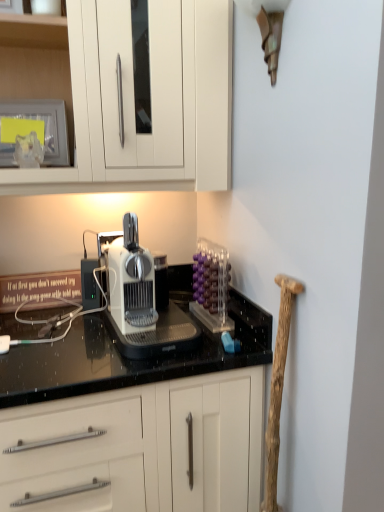
The height and width of the screenshot is (512, 384). In order to click on transparent acrylic container at upper right in this screenshot , I will do `click(211, 286)`.

Measure the distance between matte glass frame at upper left and camera.

The depth of matte glass frame at upper left is 3.73 feet.

What do you see at coordinates (35, 129) in the screenshot?
I see `matte glass frame at upper left` at bounding box center [35, 129].

Locate an element on the screen. black granite countertop at center is located at coordinates (127, 358).

Identify the location of transparent acrylic container at upper right. The width and height of the screenshot is (384, 512). (211, 286).

Which is more distant, [280,412] or [126,380]?

Point [280,412]

From the picture: Does wooden at right turn towards black granite countertop at center?

No.

Who is shorter, wooden at right or black granite countertop at center?

With less height is wooden at right.

What's the angular difference between wooden at right and black granite countertop at center's facing directions?

The angle between the facing direction of wooden at right and the facing direction of black granite countertop at center is 89.8 degrees.

From the picture: Does transparent acrylic container at upper right come behind white plastic coffee machine at center?

Yes, it is behind white plastic coffee machine at center.

Based on the photo, how many degrees apart are the facing directions of transparent acrylic container at upper right and white plastic coffee machine at center?

There is a 3.25-degree angle between the facing directions of transparent acrylic container at upper right and white plastic coffee machine at center.

Based on the photo, can you see transparent acrylic container at upper right touching white plastic coffee machine at center?

transparent acrylic container at upper right is not next to white plastic coffee machine at center, and they're not touching.

Which is more distant, (x=42, y=137) or (x=289, y=294)?

The point (x=42, y=137) is farther.

Considering the sizes of objects matte glass frame at upper left and wooden at right in the image provided, who is shorter, matte glass frame at upper left or wooden at right?

matte glass frame at upper left.

Could you tell me if matte glass frame at upper left is turned towards wooden at right?

No, matte glass frame at upper left is not oriented towards wooden at right.

Is matte glass frame at upper left to the left or to the right of wooden at right in the image?

Clearly, matte glass frame at upper left is on the left of wooden at right in the image.

What's the angular difference between white plastic coffee machine at center and matte glass frame at upper left's facing directions?

The angular difference between white plastic coffee machine at center and matte glass frame at upper left is 9.82 degrees.

Is white plastic coffee machine at center further to the viewer compared to matte glass frame at upper left?

No, white plastic coffee machine at center is closer to the viewer.

Is white plastic coffee machine at center looking in the opposite direction of matte glass frame at upper left?

That's not correct — white plastic coffee machine at center is not looking away from matte glass frame at upper left.

Between white plastic coffee machine at center and matte glass frame at upper left, which one has smaller width?

With smaller width is matte glass frame at upper left.

Find the location of a particular element. countertop below the wooden at right (from a real-world perspective) is located at coordinates (127, 358).

Which of these two, black granite countertop at center or wooden at right, is wider?

black granite countertop at center.

Is black granite countertop at center facing towards wooden at right?

Yes, black granite countertop at center is facing wooden at right.

From a real-world perspective, is black granite countertop at center beneath wooden at right?

Yes, from a real-world perspective, black granite countertop at center is under wooden at right.

From the image's perspective, is matte glass frame at upper left located above or below white plastic coffee machine at center?

Based on their image positions, matte glass frame at upper left is located above white plastic coffee machine at center.

Is matte glass frame at upper left positioned with its back to white plastic coffee machine at center?

No.

Which object is further away from the camera taking this photo, matte glass frame at upper left or white plastic coffee machine at center?

Positioned behind is matte glass frame at upper left.

Locate an element on the screen. appliance located on the left of white plastic coffee machine at center is located at coordinates (35, 129).

Can you tell me how much white plastic coffee machine at center and wooden at right differ in facing direction?

93.4 degrees.

Considering the sizes of objects white plastic coffee machine at center and wooden at right in the image provided, who is shorter, white plastic coffee machine at center or wooden at right?

white plastic coffee machine at center.

Which object is wider, white plastic coffee machine at center or wooden at right?

Wider between the two is white plastic coffee machine at center.

Find the location of a particular element. hammer that is behind the black granite countertop at center is located at coordinates (278, 388).

This screenshot has width=384, height=512. Find the location of `kitchen appliance below the white plastic coffee machine at center (from a real-world perspective)`. kitchen appliance below the white plastic coffee machine at center (from a real-world perspective) is located at coordinates (211, 286).

Looking at the image, which one is located closer to white plastic coffee machine at center, matte glass frame at upper left or black granite countertop at center?

Among the two, black granite countertop at center is located nearer to white plastic coffee machine at center.

From the image, which object appears to be nearer to wooden at right, black granite countertop at center or transparent acrylic container at upper right?

Among the two, black granite countertop at center is located nearer to wooden at right.

From the image, which object appears to be nearer to white plastic coffee machine at center, black granite countertop at center or wooden at right?

Among the two, black granite countertop at center is located nearer to white plastic coffee machine at center.

From the image, which object appears to be nearer to white plastic coffee machine at center, wooden at right or transparent acrylic container at upper right?

transparent acrylic container at upper right.

Based on their spatial positions, is transparent acrylic container at upper right or matte glass frame at upper left closer to black granite countertop at center?

transparent acrylic container at upper right.

Based on their spatial positions, is wooden at right or matte glass frame at upper left closer to transparent acrylic container at upper right?

wooden at right is closer to transparent acrylic container at upper right.

Looking at this image, looking at the image, which one is located further to white plastic coffee machine at center, transparent acrylic container at upper right or matte glass frame at upper left?

The object further to white plastic coffee machine at center is matte glass frame at upper left.

Which object lies nearer to the anchor point wooden at right, white plastic coffee machine at center or black granite countertop at center?

The object closer to wooden at right is black granite countertop at center.

Locate an element on the screen. home appliance between matte glass frame at upper left and black granite countertop at center from top to bottom is located at coordinates (139, 298).

This screenshot has height=512, width=384. Identify the location of kitchen appliance between matte glass frame at upper left and black granite countertop at center in the vertical direction. (211, 286).

At what (x,y) coordinates should I click in order to perform the action: click on kitchen appliance between white plastic coffee machine at center and wooden at right in the vertical direction. Please return your answer as a coordinate pair (x, y). This screenshot has height=512, width=384. Looking at the image, I should click on (211, 286).

I want to click on home appliance between matte glass frame at upper left and wooden at right in the vertical direction, so (139, 298).